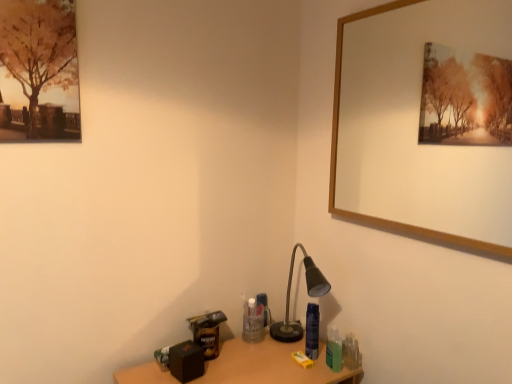
Question: Which is correct: wooden table at lower center is inside wooden picture frame at upper right, or outside of it?

Choices:
 (A) outside
 (B) inside

Answer: (A)

Question: In terms of width, does wooden table at lower center look wider or thinner when compared to wooden picture frame at upper right?

Choices:
 (A) thin
 (B) wide

Answer: (B)

Question: Which object is the closest to the wooden picture frame at upper right?

Choices:
 (A) wooden table at lower center
 (B) matte black desk lamp at lower right

Answer: (B)

Question: Which object is positioned farthest from the wooden table at lower center?

Choices:
 (A) wooden picture frame at upper right
 (B) matte black desk lamp at lower right

Answer: (A)